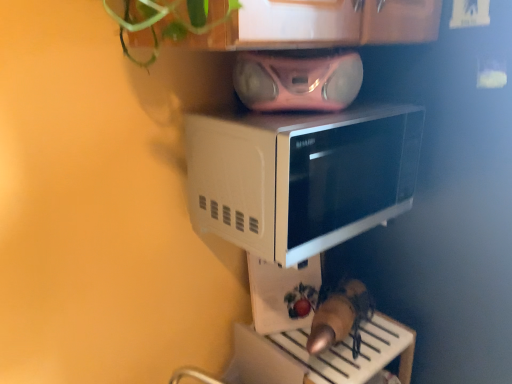
Locate an element on the screen. vacant region above pink metallic stereo at upper center (from a real-world perspective) is located at coordinates (x=300, y=51).